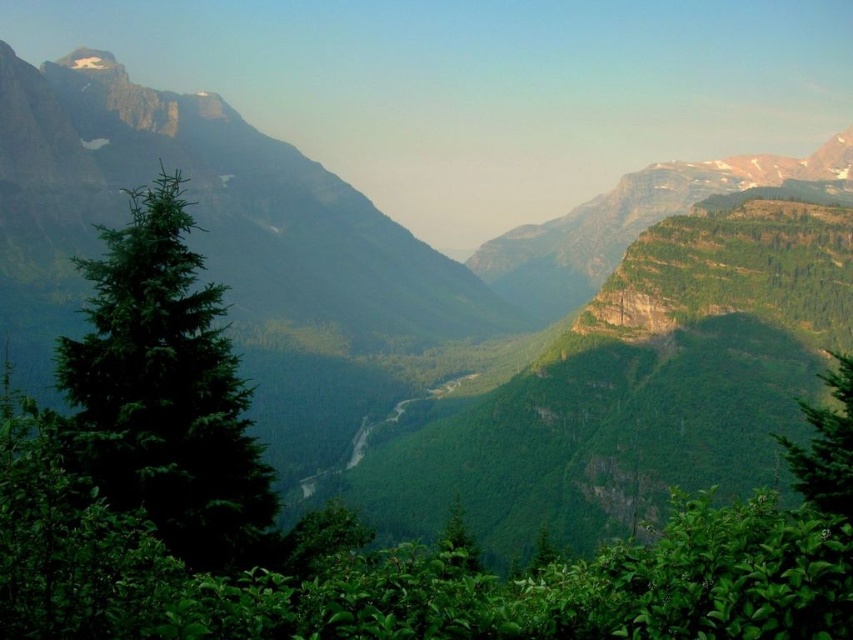
You are a hiker standing at the center of the valley looking towards the mountains. You notice the green matte tree at left and the green leafy tree at right. Which tree would appear taller from your current position?

The green matte tree at left appears taller than the green leafy tree at right from your current position because it is taller.

You are a hiker standing in the valley looking at the green matte tree at left and the green leafy tree at right. Which tree appears closer to you?

The green matte tree at left appears closer because it is in front of the green leafy tree at right, which is positioned behind it.